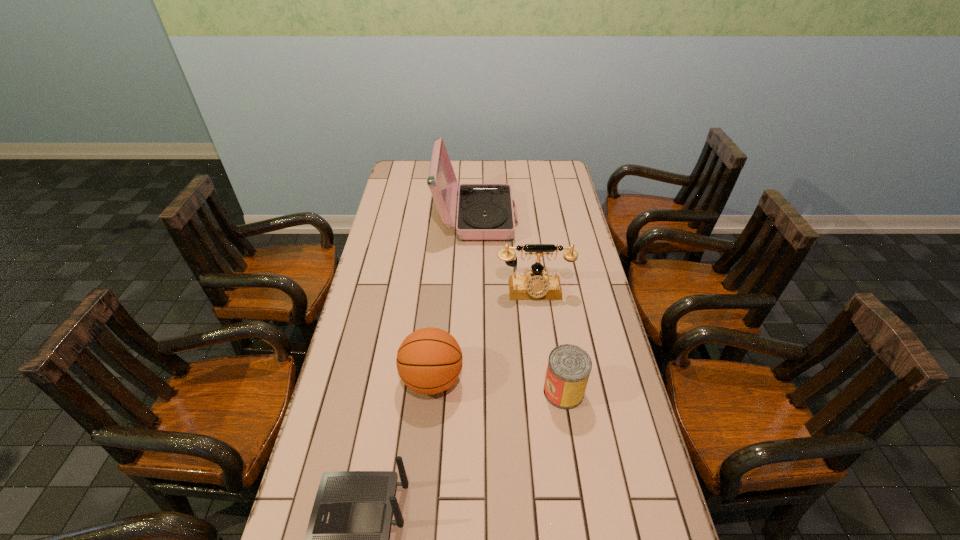
You are a GUI agent. You are given a task and a screenshot of the screen. Output one action in this format:
    pyautogui.click(x=<x>, y=<y>)
    Task: Click on the vacant space that satisfies the following two spatial constraints: 1. with the lid open on the can; 2. on the right side of the tallest object
    
    Given the screenshot: What is the action you would take?
    pyautogui.click(x=474, y=392)

Locate an element on the screen. free spot that satisfies the following two spatial constraints: 1. with the lid open on the farthest object; 2. on the right side of the can is located at coordinates (474, 392).